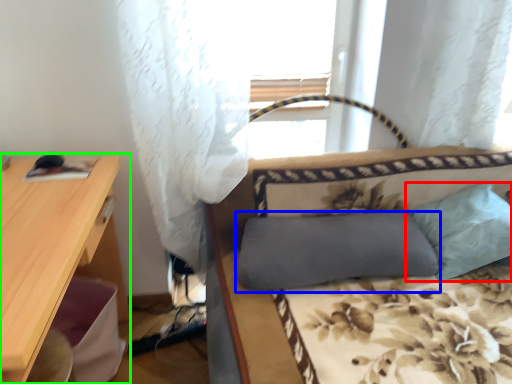
Question: Estimate the real-world distances between objects in this image. Which object is farther from pillow (highlighted by a red box), pillow (highlighted by a blue box) or desk (highlighted by a green box)?

Choices:
 (A) pillow
 (B) desk

Answer: (B)